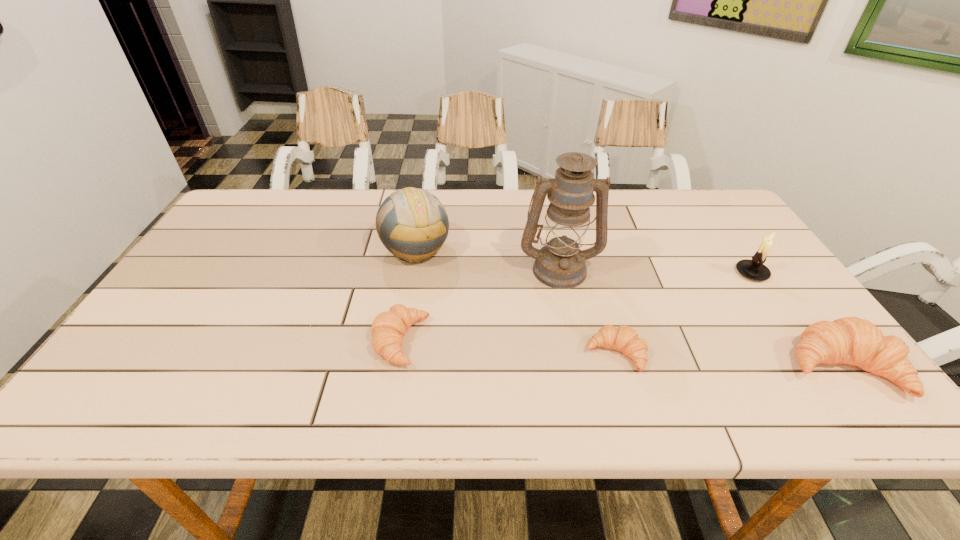
Where is `free spot between the second shortest object and the fifth shortest object`? free spot between the second shortest object and the fifth shortest object is located at coordinates (408, 295).

Identify the location of free space between the shortest crescent roll and the second shortest object. 508,348.

Locate an element on the screen. The image size is (960, 540). vacant space in between the second tallest crescent roll and the shortest crescent roll is located at coordinates (508, 348).

This screenshot has height=540, width=960. In order to click on empty space that is in between the tallest object and the second tallest crescent roll in this screenshot , I will do `click(480, 305)`.

Point out which object is positioned as the fourth nearest to the second crescent roll from left to right. Please provide its 2D coordinates. Your answer should be formatted as a tuple, i.e. [(x, y)], where the tuple contains the x and y coordinates of a point satisfying the conditions above.

[(754, 269)]

In order to click on object identified as the second closest to the volleyball in this screenshot , I will do pyautogui.click(x=560, y=264).

Identify which crescent roll is the third closest to the oil lamp. Please provide its 2D coordinates. Your answer should be formatted as a tuple, i.e. [(x, y)], where the tuple contains the x and y coordinates of a point satisfying the conditions above.

[(850, 340)]

Identify the location of the closest crescent roll to the shortest crescent roll. The width and height of the screenshot is (960, 540). (850, 340).

At what (x,y) coordinates should I click in order to perform the action: click on free point that satisfies the following two spatial constraints: 1. on the front side of the oil lamp; 2. on the right side of the shortest object. Please return your answer as a coordinate pair (x, y). Looking at the image, I should click on (576, 354).

Find the location of a particular element. This screenshot has width=960, height=540. free space that satisfies the following two spatial constraints: 1. on the front side of the fourth shortest object; 2. on the right side of the volleyball is located at coordinates (411, 273).